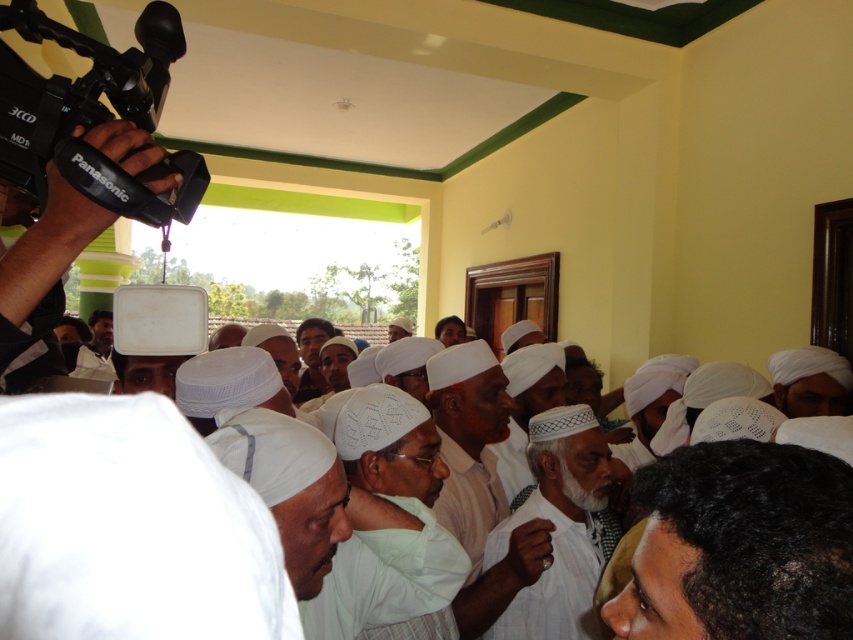
You are a photographer standing at the doorway. You want to take a photo of the black matte hair at lower right without the camera being in the frame. Can you move closer to the subject while keeping the camera in your hand?

The black matte hair at lower right and camera are 53.95 centimeters apart. Since the photographer needs to hold the camera, moving closer than 53.95 centimeters would cause the camera to overlap with the subject, so you cannot move closer than 53.95 centimeters to keep the camera out of the frame.

You are organizing a photo shoot and need to ensure that all subjects are visible in the frame. Given the black matte hair at lower right and the white woven cloth at center, which object should you focus on to ensure both are captured clearly?

The white woven cloth at center occupies more space than the black matte hair at lower right, so focusing on the white woven cloth at center would help ensure both are captured clearly since it is larger and central.

Looking at this image, you are organizing a photo shoot and need to place a small decorative item between the black matte hair at lower right and the white cotton turban at center. Given their widths, which object should the item be placed closer to?

The black matte hair at lower right has a smaller width compared to the white cotton turban at center. Therefore, the decorative item should be placed closer to the white cotton turban at center to balance their sizes.